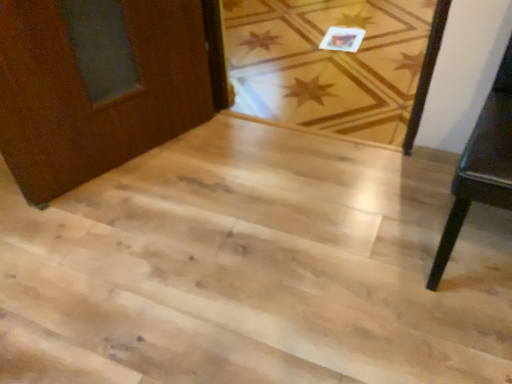
You are a GUI agent. You are given a task and a screenshot of the screen. Output one action in this format:
    pyautogui.click(x=<x>, y=<y>)
    Task: Click on the vacant space to the left of dark wood table at right
    
    Given the screenshot: What is the action you would take?
    pyautogui.click(x=351, y=239)